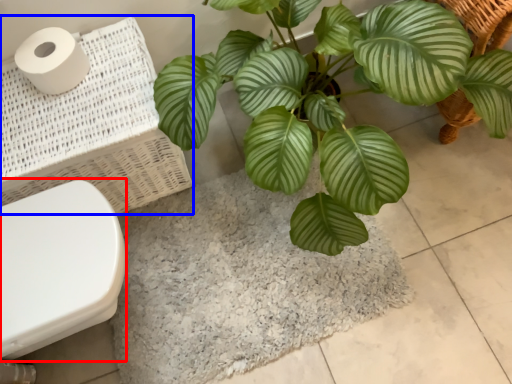
Question: Among these objects, which one is nearest to the camera, toilet bowl (highlighted by a red box) or laundry basket (highlighted by a blue box)?

Choices:
 (A) toilet bowl
 (B) laundry basket

Answer: (A)